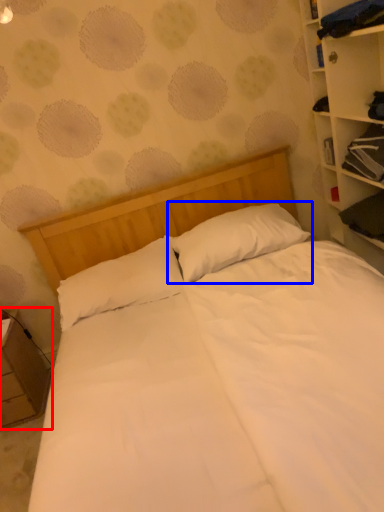
Question: Among these objects, which one is nearest to the camera, nightstand (highlighted by a red box) or pillow (highlighted by a blue box)?

Choices:
 (A) nightstand
 (B) pillow

Answer: (B)